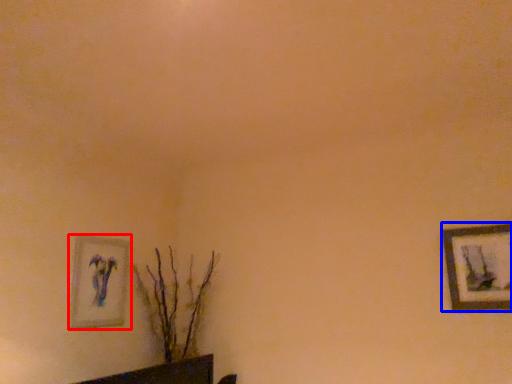
Question: Among these objects, which one is nearest to the camera, picture frame (highlighted by a red box) or picture frame (highlighted by a blue box)?

Choices:
 (A) picture frame
 (B) picture frame

Answer: (B)